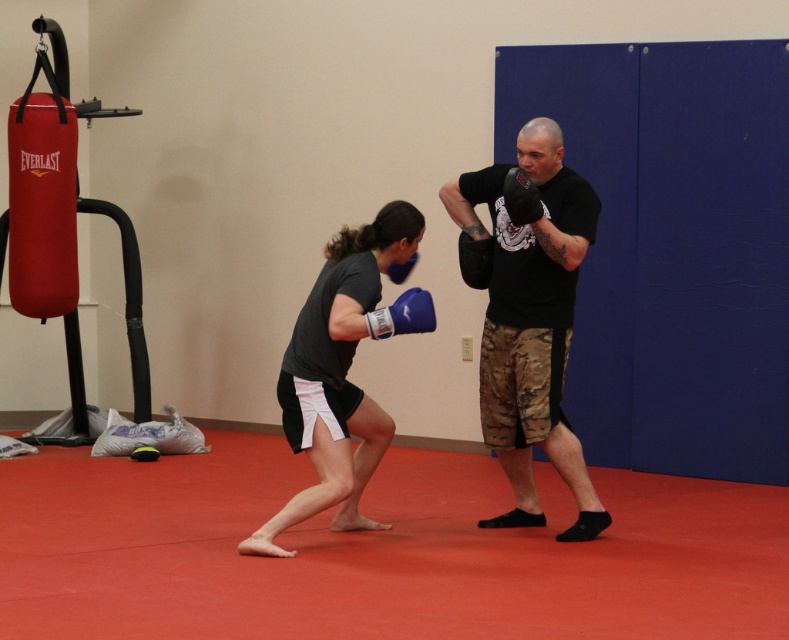
Does point (541, 150) come closer to viewer compared to point (365, 467)?

Yes, it is.

This screenshot has height=640, width=789. Describe the element at coordinates (529, 316) in the screenshot. I see `black matte t-shirt at center` at that location.

This screenshot has height=640, width=789. Find the location of `black matte t-shirt at center`. black matte t-shirt at center is located at coordinates (529, 316).

Consider the image. Can you confirm if black matte t-shirt at center is shorter than blue synthetic boxing glove at center?

Incorrect, black matte t-shirt at center's height does not fall short of blue synthetic boxing glove at center's.

Between point (520, 330) and point (408, 292), which one is positioned in front?

Point (408, 292)

The height and width of the screenshot is (640, 789). What are the coordinates of `black matte t-shirt at center` in the screenshot? It's located at (529, 316).

Does matte blue boxing glove at center appear on the left side of blue synthetic boxing glove at center?

Correct, you'll find matte blue boxing glove at center to the left of blue synthetic boxing glove at center.

Between matte blue boxing glove at center and blue synthetic boxing glove at center, which one is positioned higher?

blue synthetic boxing glove at center is above.

What are the coordinates of `matte blue boxing glove at center` in the screenshot? It's located at (338, 374).